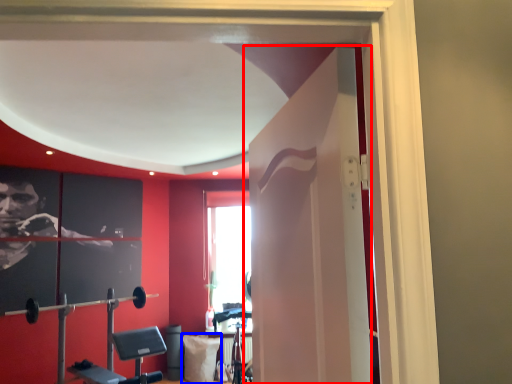
Question: Which object appears farthest to the camera in this image, door (highlighted by a red box) or pillow (highlighted by a blue box)?

Choices:
 (A) door
 (B) pillow

Answer: (B)